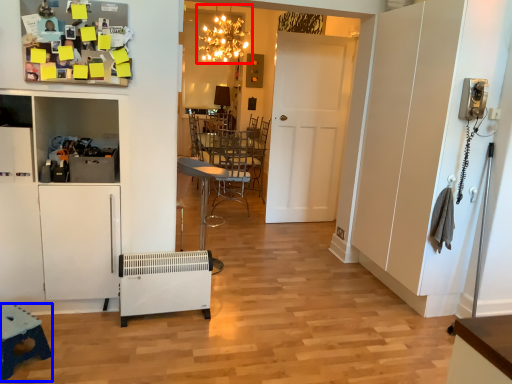
Question: Which object appears farthest to the camera in this image, light fixture (highlighted by a red box) or table (highlighted by a blue box)?

Choices:
 (A) light fixture
 (B) table

Answer: (A)